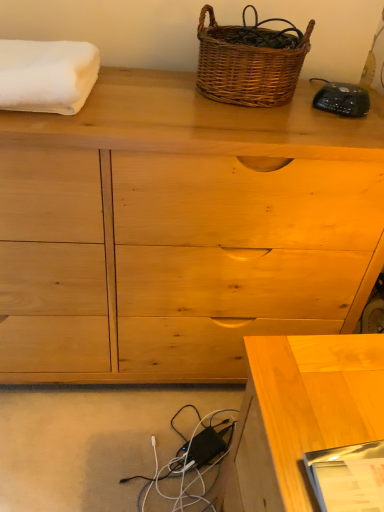
Question: Is white fluffy towel at upper left beside woven brown picnic basket at upper center?

Choices:
 (A) no
 (B) yes

Answer: (A)

Question: Can you confirm if white fluffy towel at upper left is bigger than woven brown picnic basket at upper center?

Choices:
 (A) no
 (B) yes

Answer: (A)

Question: From a real-world perspective, is white fluffy towel at upper left positioned over woven brown picnic basket at upper center based on gravity?

Choices:
 (A) no
 (B) yes

Answer: (A)

Question: Does white fluffy towel at upper left have a greater width compared to woven brown picnic basket at upper center?

Choices:
 (A) no
 (B) yes

Answer: (B)

Question: Is white fluffy towel at upper left at the right side of woven brown picnic basket at upper center?

Choices:
 (A) yes
 (B) no

Answer: (B)

Question: From a real-world perspective, is white fluffy towel at upper left beneath woven brown picnic basket at upper center?

Choices:
 (A) yes
 (B) no

Answer: (A)

Question: From a real-world perspective, is light wood desk at lower right positioned under black plastic remote at upper right based on gravity?

Choices:
 (A) no
 (B) yes

Answer: (B)

Question: Can you confirm if light wood desk at lower right is taller than black plastic remote at upper right?

Choices:
 (A) no
 (B) yes

Answer: (B)

Question: Are light wood desk at lower right and black plastic remote at upper right located far from each other?

Choices:
 (A) yes
 (B) no

Answer: (B)

Question: Does light wood desk at lower right contain black plastic remote at upper right?

Choices:
 (A) no
 (B) yes

Answer: (A)

Question: Can you confirm if light wood desk at lower right is thinner than black plastic remote at upper right?

Choices:
 (A) no
 (B) yes

Answer: (A)

Question: Does light wood desk at lower right lie in front of black plastic remote at upper right?

Choices:
 (A) yes
 (B) no

Answer: (A)

Question: Is light wood desk at lower right not within natural wood chest of drawers at center?

Choices:
 (A) no
 (B) yes

Answer: (B)